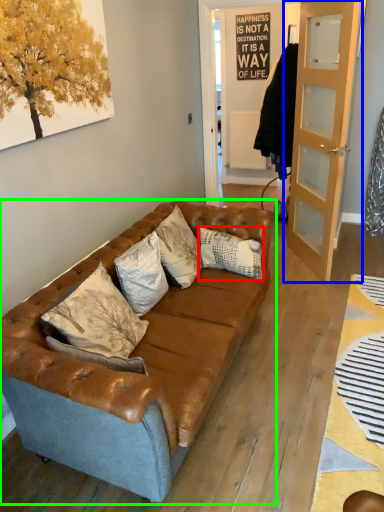
Question: Considering the real-world distances, which object is closest to pillow (highlighted by a red box)? door (highlighted by a blue box) or studio couch (highlighted by a green box).

Choices:
 (A) door
 (B) studio couch

Answer: (B)